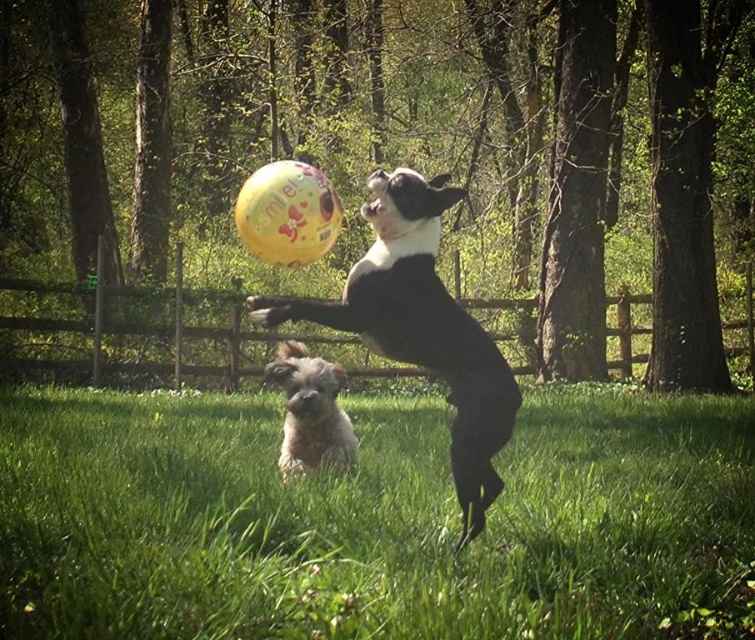
Between point (368, 342) and point (288, 380), which one is positioned in front?

Point (368, 342) is in front.

Who is lower down, black and white fur dog at center or fluffy white dog at lower center?

fluffy white dog at lower center is below.

The height and width of the screenshot is (640, 755). I want to click on black and white fur dog at center, so click(x=421, y=328).

Image resolution: width=755 pixels, height=640 pixels. What are the coordinates of `black and white fur dog at center` in the screenshot? It's located at (421, 328).

Which is more to the left, green grass at lower center or fluffy white dog at lower center?

From the viewer's perspective, fluffy white dog at lower center appears more on the left side.

Is green grass at lower center thinner than fluffy white dog at lower center?

Yes.

This screenshot has width=755, height=640. What do you see at coordinates (364, 518) in the screenshot? I see `green grass at lower center` at bounding box center [364, 518].

This screenshot has width=755, height=640. I want to click on green grass at lower center, so click(364, 518).

Between green grass at lower center and black and white fur dog at center, which one has more height?

Standing taller between the two is black and white fur dog at center.

Consider the image. Is green grass at lower center to the left of black and white fur dog at center from the viewer's perspective?

Incorrect, green grass at lower center is not on the left side of black and white fur dog at center.

Where is `green grass at lower center`? green grass at lower center is located at coordinates (364, 518).